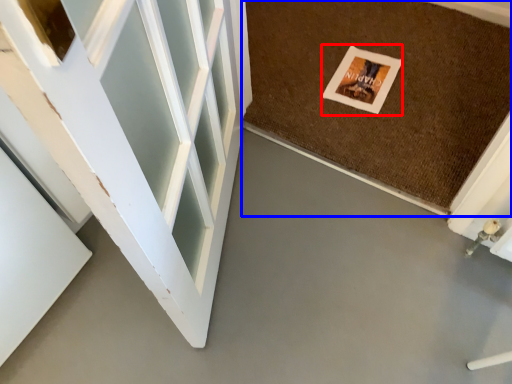
Question: Which of the following is the farthest to the observer, postcard (highlighted by a red box) or mat (highlighted by a blue box)?

Choices:
 (A) postcard
 (B) mat

Answer: (A)